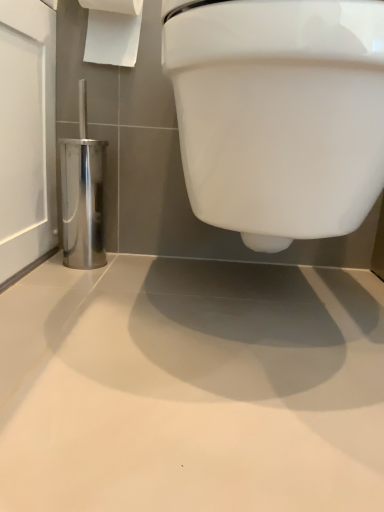
Question: Is white paper at upper left outside polished metallic toilet brush holder at left?

Choices:
 (A) yes
 (B) no

Answer: (A)

Question: Does white paper at upper left have a larger size compared to polished metallic toilet brush holder at left?

Choices:
 (A) yes
 (B) no

Answer: (B)

Question: Considering the relative sizes of white paper at upper left and polished metallic toilet brush holder at left in the image provided, is white paper at upper left shorter than polished metallic toilet brush holder at left?

Choices:
 (A) yes
 (B) no

Answer: (A)

Question: Does white paper at upper left appear on the left side of polished metallic toilet brush holder at left?

Choices:
 (A) no
 (B) yes

Answer: (A)

Question: Is there a large distance between white paper at upper left and polished metallic toilet brush holder at left?

Choices:
 (A) yes
 (B) no

Answer: (B)

Question: Looking at the image, does polished metallic toilet brush holder at left seem bigger or smaller compared to white glossy toilet at upper center?

Choices:
 (A) big
 (B) small

Answer: (B)

Question: In the image, is polished metallic toilet brush holder at left positioned in front of or behind white glossy toilet at upper center?

Choices:
 (A) behind
 (B) front

Answer: (A)

Question: In terms of width, does polished metallic toilet brush holder at left look wider or thinner when compared to white glossy toilet at upper center?

Choices:
 (A) thin
 (B) wide

Answer: (A)

Question: Considering the positions of polished metallic toilet brush holder at left and white glossy toilet at upper center in the image, is polished metallic toilet brush holder at left taller or shorter than white glossy toilet at upper center?

Choices:
 (A) tall
 (B) short

Answer: (B)

Question: From their relative heights in the image, would you say white paper at upper left is taller or shorter than white glossy toilet at upper center?

Choices:
 (A) tall
 (B) short

Answer: (B)

Question: From a real-world perspective, is white paper at upper left above or below white glossy toilet at upper center?

Choices:
 (A) below
 (B) above

Answer: (B)

Question: Considering their positions, is white paper at upper left located in front of or behind white glossy toilet at upper center?

Choices:
 (A) behind
 (B) front

Answer: (A)

Question: Does point tap(97, 26) appear closer or farther from the camera than point tap(218, 116)?

Choices:
 (A) farther
 (B) closer

Answer: (A)

Question: Based on their sizes in the image, would you say white glossy toilet at upper center is bigger or smaller than polished metallic toilet brush holder at left?

Choices:
 (A) big
 (B) small

Answer: (A)

Question: From the image's perspective, is white glossy toilet at upper center positioned above or below polished metallic toilet brush holder at left?

Choices:
 (A) above
 (B) below

Answer: (B)